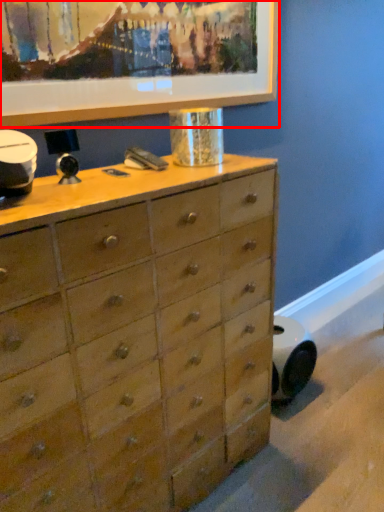
Question: Observing the image, what is the correct spatial positioning of picture frame (annotated by the red box) in reference to chest of drawers?

Choices:
 (A) right
 (B) left

Answer: (A)